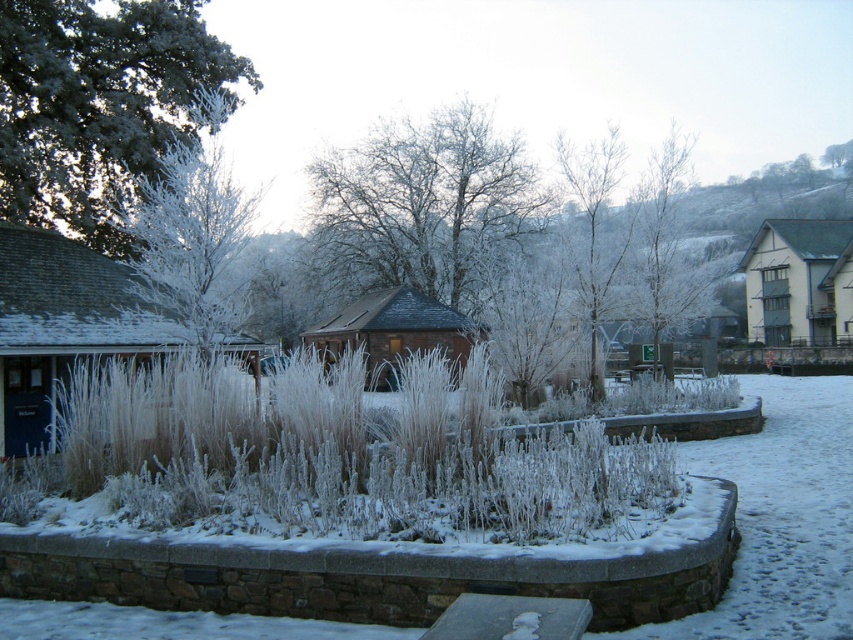
Question: Can you confirm if frosty bark tree at center is positioned below white frosty tree at left?

Choices:
 (A) no
 (B) yes

Answer: (A)

Question: Which point is closer to the camera?

Choices:
 (A) white frosty tree at left
 (B) frosted grass at center

Answer: (B)

Question: Which point is farther to the camera?

Choices:
 (A) white frosty tree at left
 (B) frosty bark tree at upper left

Answer: (B)

Question: Which point is closer to the camera taking this photo?

Choices:
 (A) (614, 161)
 (B) (193, 188)

Answer: (B)

Question: Does frosty bark tree at upper left have a smaller size compared to frosty bark tree at center?

Choices:
 (A) no
 (B) yes

Answer: (B)

Question: Is the position of frosted grass at center more distant than that of frosty bark tree at center?

Choices:
 (A) no
 (B) yes

Answer: (A)